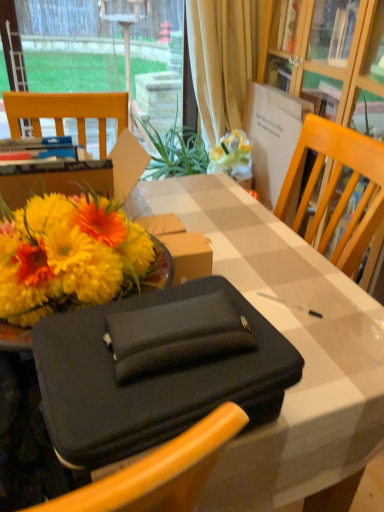
Question: Is black fabric briefcase at center not inside transparent glass window at upper left?

Choices:
 (A) yes
 (B) no

Answer: (A)

Question: Considering the relative sizes of black fabric briefcase at center and transparent glass window at upper left in the image provided, is black fabric briefcase at center bigger than transparent glass window at upper left?

Choices:
 (A) no
 (B) yes

Answer: (B)

Question: Is black fabric briefcase at center wider than transparent glass window at upper left?

Choices:
 (A) yes
 (B) no

Answer: (A)

Question: Is black fabric briefcase at center positioned with its back to transparent glass window at upper left?

Choices:
 (A) no
 (B) yes

Answer: (A)

Question: Considering the relative sizes of black fabric briefcase at center and transparent glass window at upper left in the image provided, is black fabric briefcase at center taller than transparent glass window at upper left?

Choices:
 (A) no
 (B) yes

Answer: (A)

Question: Does black fabric briefcase at center turn towards transparent glass window at upper left?

Choices:
 (A) yes
 (B) no

Answer: (A)

Question: Considering the relative sizes of beige fabric curtain at upper center and black fabric briefcase at center in the image provided, is beige fabric curtain at upper center thinner than black fabric briefcase at center?

Choices:
 (A) yes
 (B) no

Answer: (A)

Question: Is beige fabric curtain at upper center wider than black fabric briefcase at center?

Choices:
 (A) no
 (B) yes

Answer: (A)

Question: Can you confirm if beige fabric curtain at upper center is taller than black fabric briefcase at center?

Choices:
 (A) yes
 (B) no

Answer: (A)

Question: Can you confirm if beige fabric curtain at upper center is positioned to the left of black fabric briefcase at center?

Choices:
 (A) yes
 (B) no

Answer: (B)

Question: Considering the relative sizes of beige fabric curtain at upper center and black fabric briefcase at center in the image provided, is beige fabric curtain at upper center shorter than black fabric briefcase at center?

Choices:
 (A) no
 (B) yes

Answer: (A)

Question: Is beige fabric curtain at upper center at the right side of black fabric briefcase at center?

Choices:
 (A) no
 (B) yes

Answer: (B)

Question: Is beige fabric curtain at upper center inside black fabric briefcase at center?

Choices:
 (A) no
 (B) yes

Answer: (A)